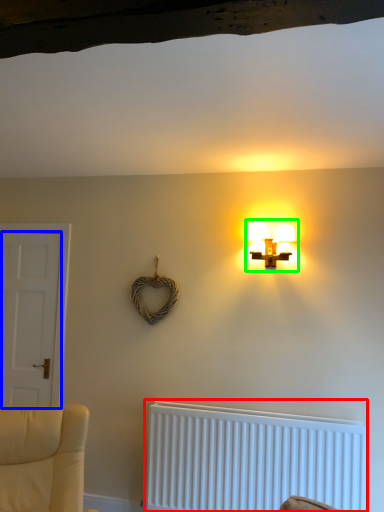
Question: Estimate the real-world distances between objects in this image. Which object is farther from radiator (highlighted by a red box), door (highlighted by a blue box) or lamp (highlighted by a green box)?

Choices:
 (A) door
 (B) lamp

Answer: (A)